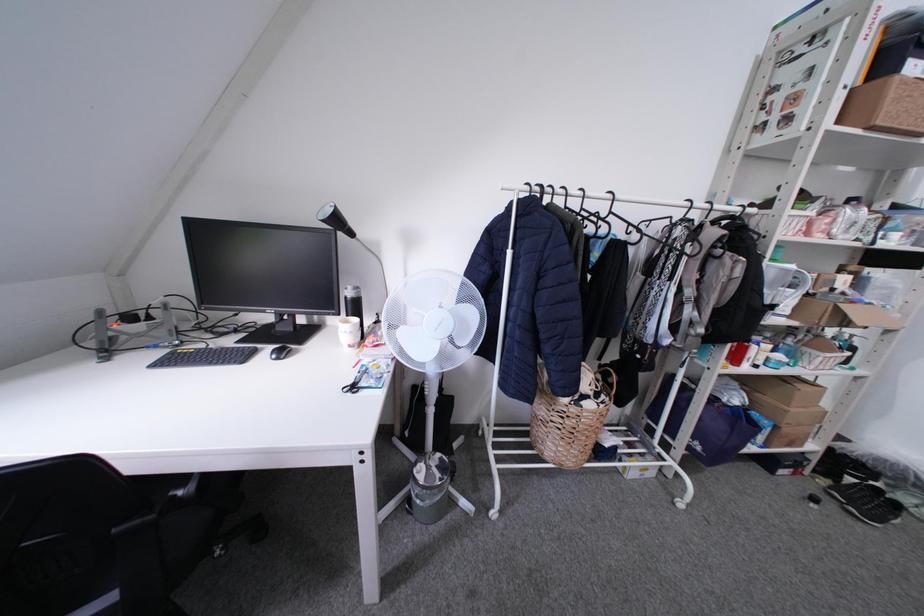
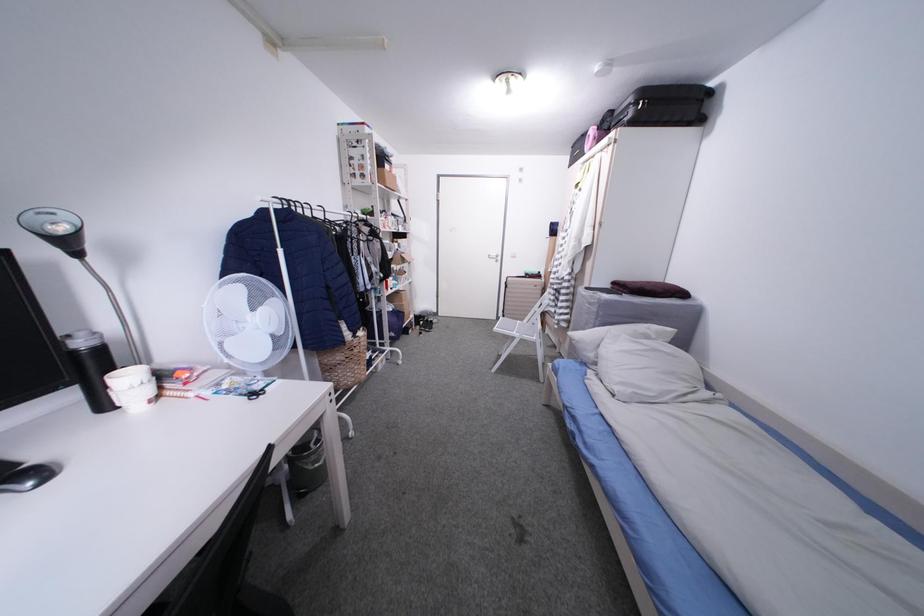
How did the camera likely rotate?

The camera's rotation is toward right-down.